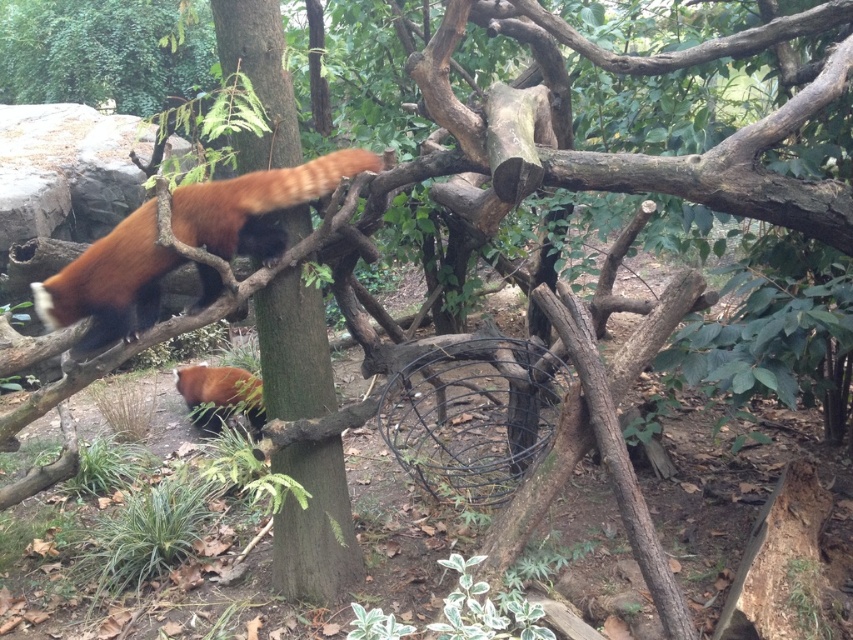
In the scene shown: Between fuzzy reddish-brown fur at upper left and fluffy reddish-brown fur at lower center, which one is positioned higher?

A: fuzzy reddish-brown fur at upper left is higher up.

Can you confirm if fuzzy reddish-brown fur at upper left is positioned to the right of fluffy reddish-brown fur at lower center?

Indeed, fuzzy reddish-brown fur at upper left is positioned on the right side of fluffy reddish-brown fur at lower center.

Does point (134, 317) come farther from viewer compared to point (178, 368)?

No, (134, 317) is closer to viewer.

What are the coordinates of `fuzzy reddish-brown fur at upper left` in the screenshot? It's located at (109, 284).

Is green rough bark tree trunk at center in front of fluffy reddish-brown fur at lower center?

Yes, green rough bark tree trunk at center is in front of fluffy reddish-brown fur at lower center.

Between green rough bark tree trunk at center and fluffy reddish-brown fur at lower center, which one is positioned lower?

fluffy reddish-brown fur at lower center

Measure the distance between point (x=312, y=531) and camera.

Point (x=312, y=531) is 3.42 meters from camera.

Image resolution: width=853 pixels, height=640 pixels. Find the location of `green rough bark tree trunk at center`. green rough bark tree trunk at center is located at coordinates (315, 525).

This screenshot has width=853, height=640. What are the coordinates of `green rough bark tree trunk at center` in the screenshot? It's located at (315, 525).

Between green rough bark tree trunk at center and fuzzy reddish-brown fur at upper left, which one appears on the left side from the viewer's perspective?

fuzzy reddish-brown fur at upper left is more to the left.

This screenshot has width=853, height=640. What do you see at coordinates (315, 525) in the screenshot? I see `green rough bark tree trunk at center` at bounding box center [315, 525].

Identify the location of green rough bark tree trunk at center. The width and height of the screenshot is (853, 640). (315, 525).